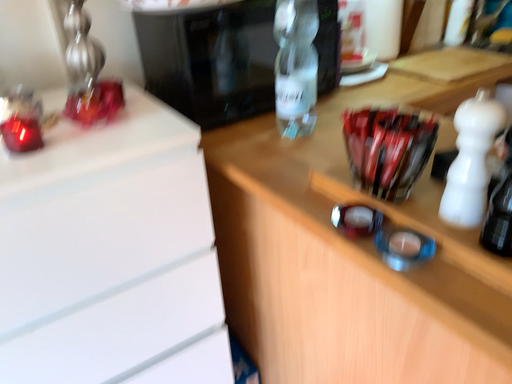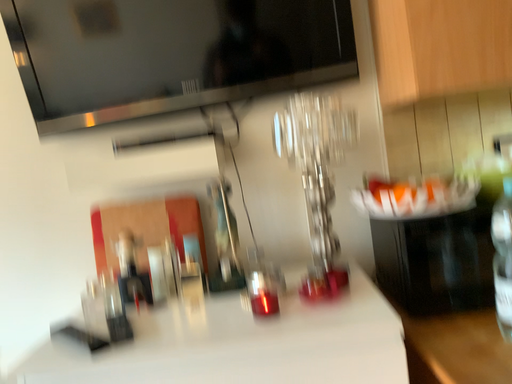
Question: Which way did the camera rotate in the video?

Choices:
 (A) rotated downward
 (B) rotated upward

Answer: (B)